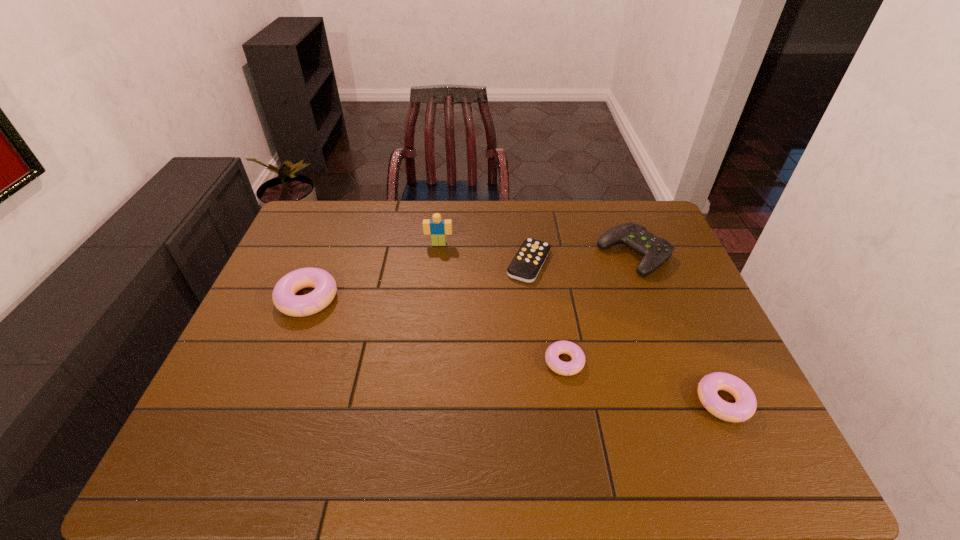
Point out which doughnut is positioned as the second nearest to the third shortest object. Please provide its 2D coordinates. Your answer should be formatted as a tuple, i.e. [(x, y)], where the tuple contains the x and y coordinates of a point satisfying the conditions above.

[(284, 298)]

Identify the location of blank space that satisfies the following two spatial constraints: 1. on the back side of the control; 2. on the right side of the shortest doughnut. (546, 254).

The height and width of the screenshot is (540, 960). I want to click on vacant point that satisfies the following two spatial constraints: 1. on the face of the control; 2. on the right side of the fifth object from right to left, so click(438, 254).

This screenshot has height=540, width=960. I want to click on free region that satisfies the following two spatial constraints: 1. on the back side of the remote control; 2. on the left side of the control, so click(x=528, y=254).

This screenshot has width=960, height=540. What are the coordinates of `vacant space that satisfies the following two spatial constraints: 1. on the face of the second object from left to right; 2. on the right side of the control` in the screenshot? It's located at (438, 254).